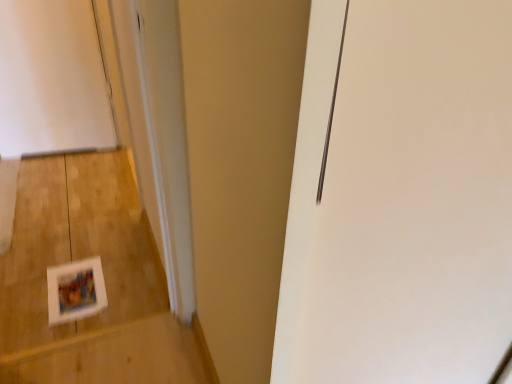
The width and height of the screenshot is (512, 384). In order to click on empty space that is ontop of white matte frame at lower left (from a real-world perspective) in this screenshot , I will do `click(73, 221)`.